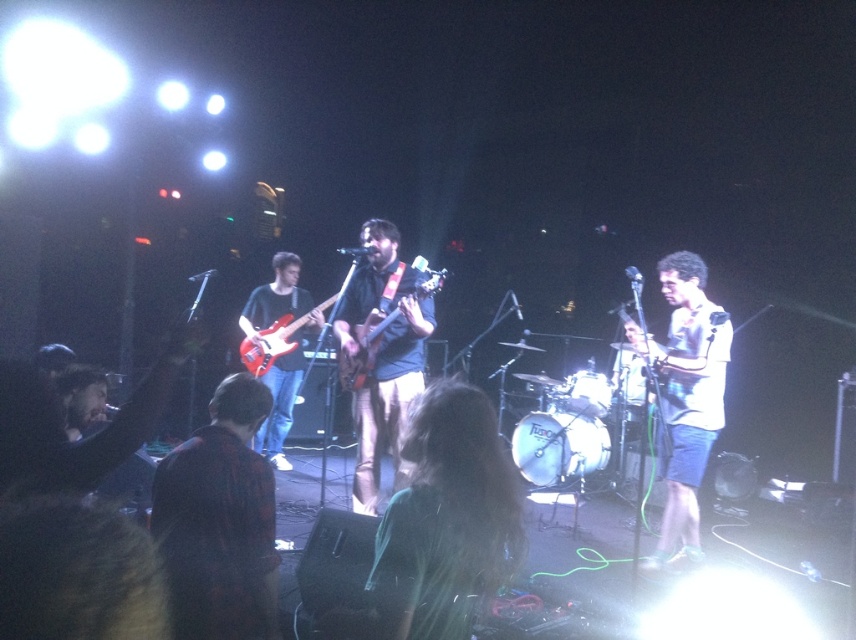
You are a stagehand setting up equipment. You need to place a new amplifier that requires 1.2 meters of space. There are two matte red electric guitars on stage. Can you fit the amplifier between the matte red electric guitar at left and the matte red electric guitar at center?

The matte red electric guitar at left is bigger than the matte red electric guitar at center, but the distance between them isn

You are standing in the audience and see the matte red electric guitar at left on stage. If you want to throw a small object to the guitar, would you need to aim far or close?

The matte red electric guitar at left is 17.27 feet away from you, so you would need to aim far to reach it.

Based on the photo, you are a photographer at the back of the venue trying to capture a clear shot of the stage. There are two points of interest marked on your camera screen at coordinates point (x=263, y=449) and point (x=629, y=364). Which point is closer to you, the photographer?

Point (x=263, y=449) is in front of point (x=629, y=364), so it is closer to you.